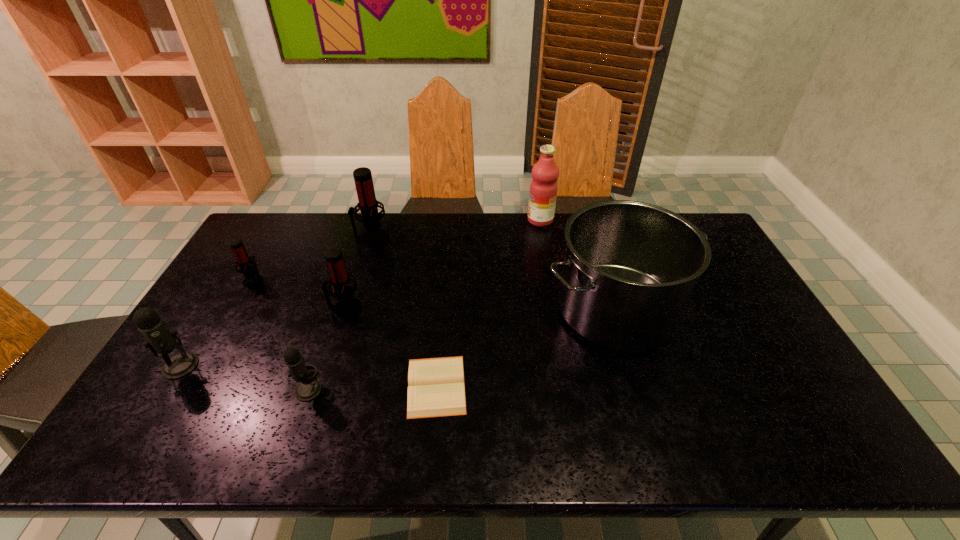
Locate an element on the screen. This screenshot has width=960, height=540. object that stands as the fourth closest to the second biggest red microphone is located at coordinates (374, 236).

Locate an element on the screen. The height and width of the screenshot is (540, 960). object that can be found as the fifth closest to the farthest object is located at coordinates (309, 388).

Identify which microphone is the fourth nearest to the bigger black microphone. Please provide its 2D coordinates. Your answer should be formatted as a tuple, i.e. [(x, y)], where the tuple contains the x and y coordinates of a point satisfying the conditions above.

[(374, 236)]

Where is `microphone that stands as the second closest to the seventh nearest object`? microphone that stands as the second closest to the seventh nearest object is located at coordinates (248, 268).

Choose which red microphone is the second nearest neighbor to the pink fruit juice. Please provide its 2D coordinates. Your answer should be formatted as a tuple, i.e. [(x, y)], where the tuple contains the x and y coordinates of a point satisfying the conditions above.

[(347, 306)]

Identify which red microphone is the second nearest to the saucepan. Please provide its 2D coordinates. Your answer should be formatted as a tuple, i.e. [(x, y)], where the tuple contains the x and y coordinates of a point satisfying the conditions above.

[(347, 306)]

Find the location of a particular element. The width and height of the screenshot is (960, 540). free region that satisfies the following two spatial constraints: 1. on the back side of the smaller black microphone; 2. on the right side of the saucepan is located at coordinates [335, 309].

This screenshot has height=540, width=960. Find the location of `free space that satisfies the following two spatial constraints: 1. on the label of the pink fruit juice; 2. on the front side of the farthest red microphone`. free space that satisfies the following two spatial constraints: 1. on the label of the pink fruit juice; 2. on the front side of the farthest red microphone is located at coordinates (543, 238).